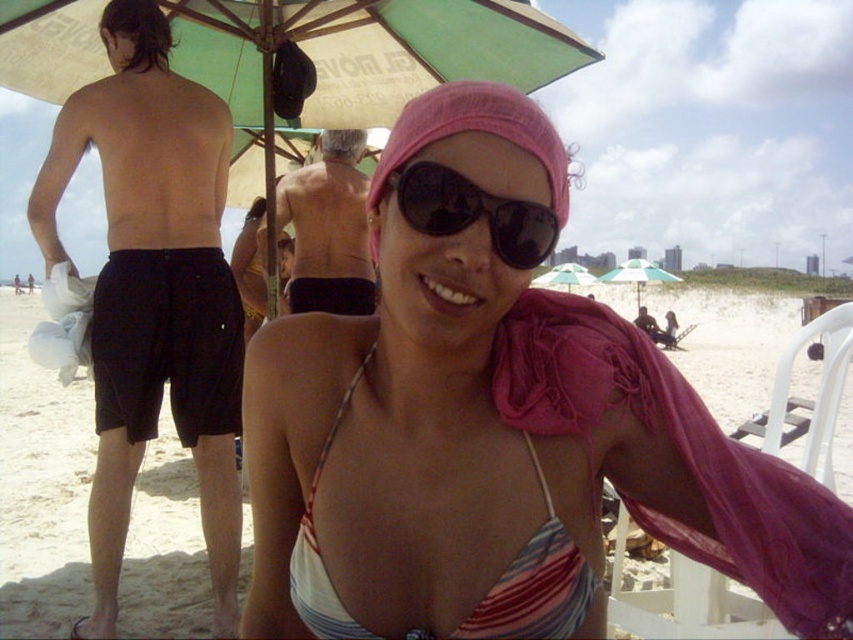
Which of these two, pink fabric bikini top at center or black cotton shorts at left, stands taller?

black cotton shorts at left is taller.

What do you see at coordinates (495, 422) in the screenshot? The image size is (853, 640). I see `pink fabric bikini top at center` at bounding box center [495, 422].

Does point (570, 460) lie behind point (212, 125)?

No.

Find the location of a particular element. This screenshot has height=640, width=853. pink fabric bikini top at center is located at coordinates (495, 422).

Between black cotton shorts at left and smooth tan skin at center, which one appears on the left side from the viewer's perspective?

black cotton shorts at left

How distant is black cotton shorts at left from smooth tan skin at center?

black cotton shorts at left and smooth tan skin at center are 3.78 feet apart from each other.

The width and height of the screenshot is (853, 640). I want to click on black cotton shorts at left, so click(154, 291).

Is white plastic beach chair at lower right wider than black reflective sunglasses at center?

Yes, white plastic beach chair at lower right is wider than black reflective sunglasses at center.

Which of these two, white plastic beach chair at lower right or black reflective sunglasses at center, stands shorter?

black reflective sunglasses at center

The width and height of the screenshot is (853, 640). Describe the element at coordinates (683, 602) in the screenshot. I see `white plastic beach chair at lower right` at that location.

This screenshot has width=853, height=640. What are the coordinates of `white plastic beach chair at lower right` in the screenshot? It's located at (683, 602).